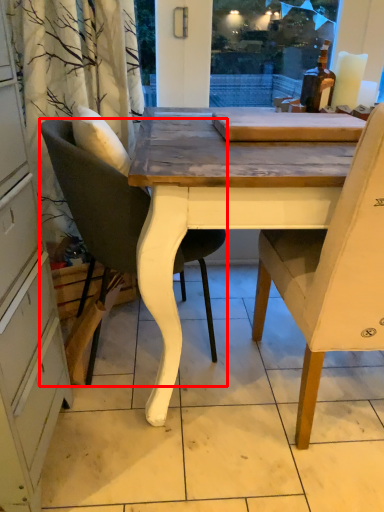
Question: From the image, what is the correct spatial relationship of chair (annotated by the red box) in relation to chair?

Choices:
 (A) right
 (B) left

Answer: (B)